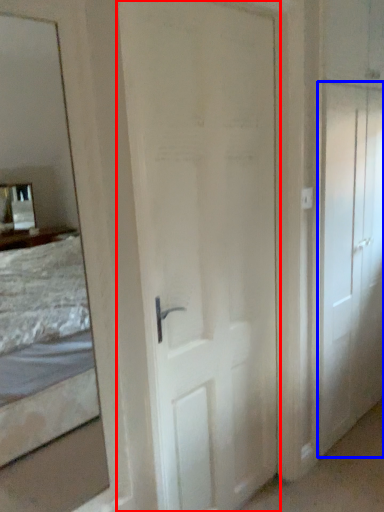
Question: Which of the following is the farthest to the observer, door (highlighted by a red box) or door (highlighted by a blue box)?

Choices:
 (A) door
 (B) door

Answer: (B)